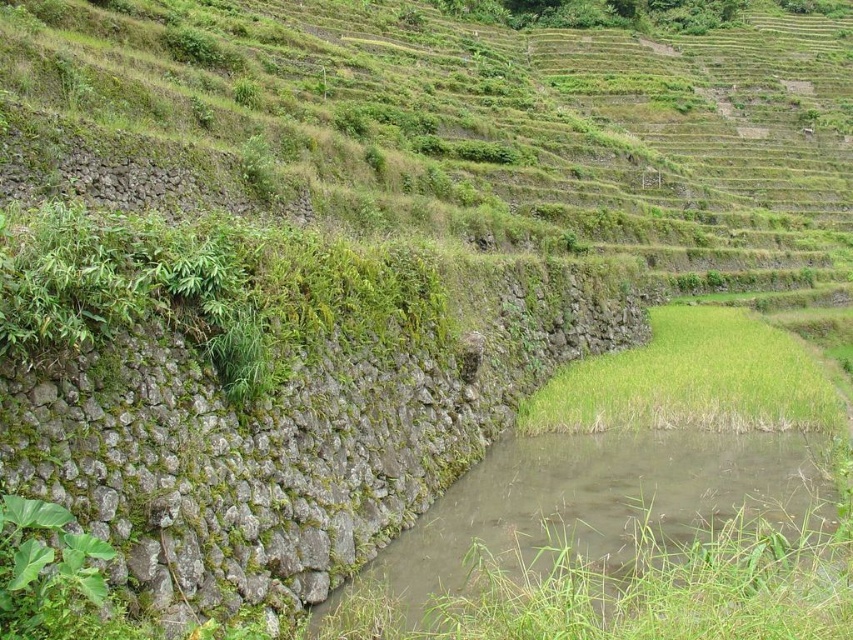
Question: Among these objects, which one is nearest to the camera?

Choices:
 (A) muddy stone stream at lower center
 (B) green grass at lower right
 (C) green mossy wall at center-left

Answer: (A)

Question: Estimate the real-world distances between objects in this image. Which object is farther from the green mossy wall at center-left?

Choices:
 (A) green grass at lower right
 (B) muddy stone stream at lower center

Answer: (A)

Question: In this image, where is muddy stone stream at lower center located relative to green grass at lower right?

Choices:
 (A) left
 (B) right

Answer: (A)

Question: Does green mossy wall at center-left lie behind green grass at lower right?

Choices:
 (A) no
 (B) yes

Answer: (A)

Question: Is muddy stone stream at lower center to the right of green grass at lower right from the viewer's perspective?

Choices:
 (A) yes
 (B) no

Answer: (B)

Question: Which point is closer to the camera taking this photo?

Choices:
 (A) click(x=416, y=296)
 (B) click(x=650, y=323)
 (C) click(x=682, y=525)

Answer: (C)